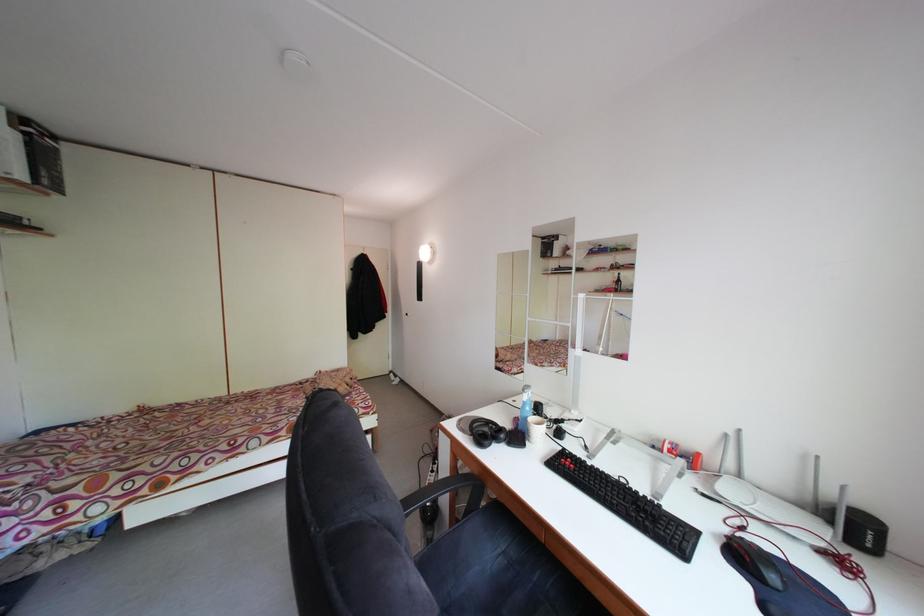
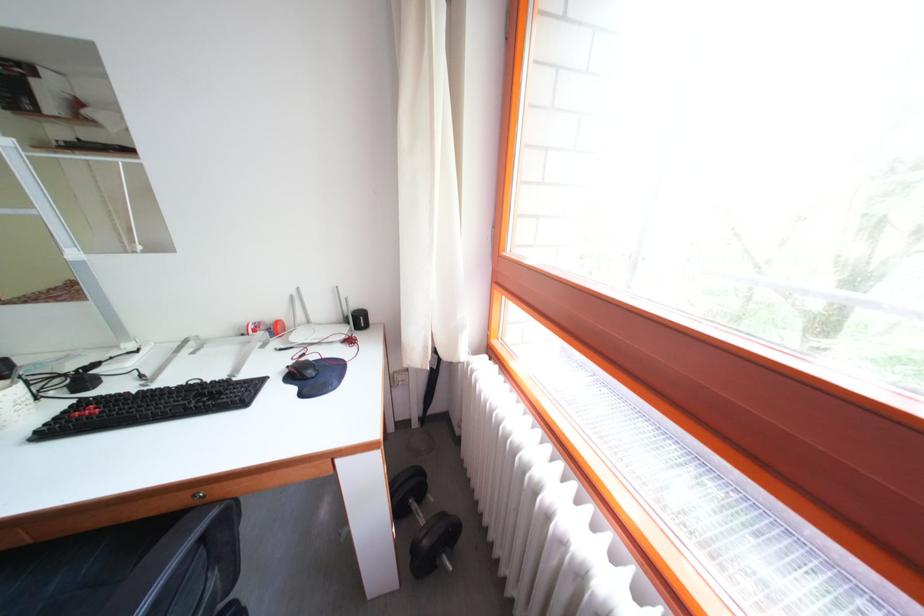
Locate, in the second image, the point that corresponds to point 735,442 in the first image.

(300, 302)